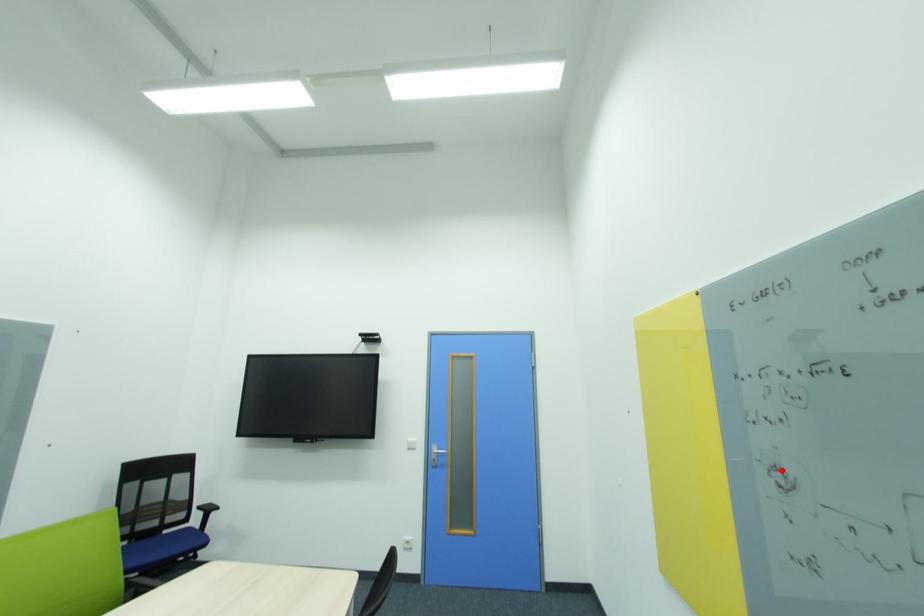
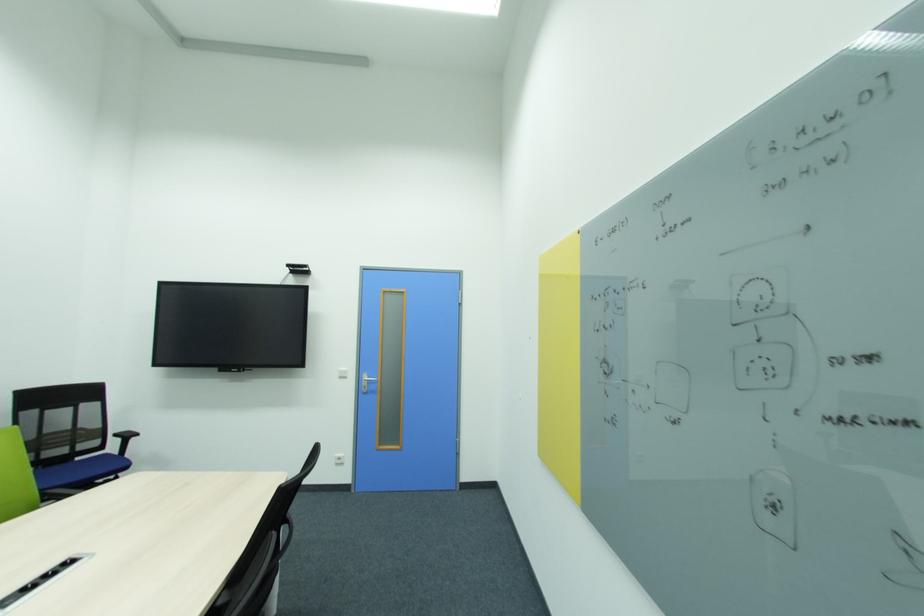
In the second image, find the point that corresponds to the highlighted location in the first image.

(610, 362)